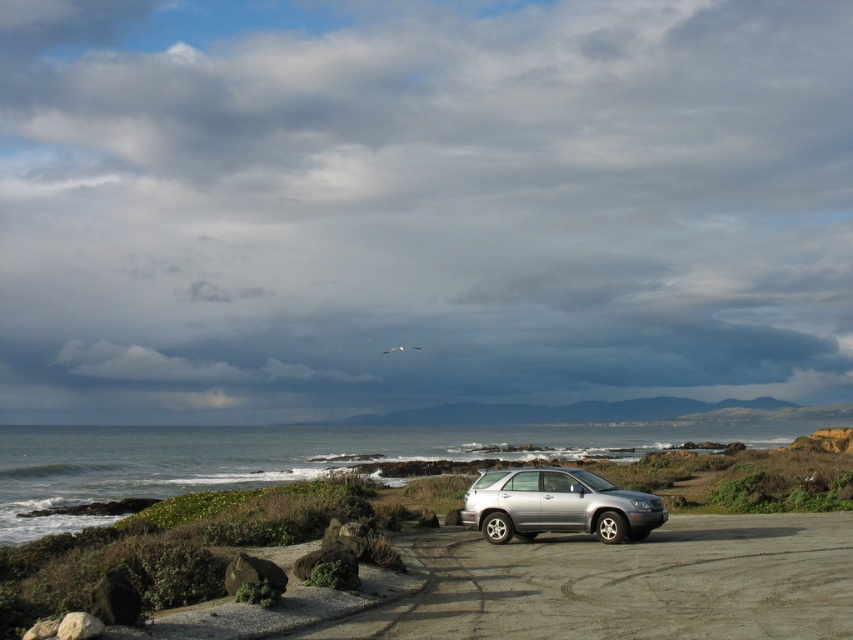
Between silver metallic suv at center and satin silver suv at center, which one has more height?

silver metallic suv at center

Who is more distant from viewer, (x=413, y=435) or (x=480, y=490)?

The point (x=413, y=435) is behind.

Locate an element on the screen. Image resolution: width=853 pixels, height=640 pixels. silver metallic suv at center is located at coordinates (631, 582).